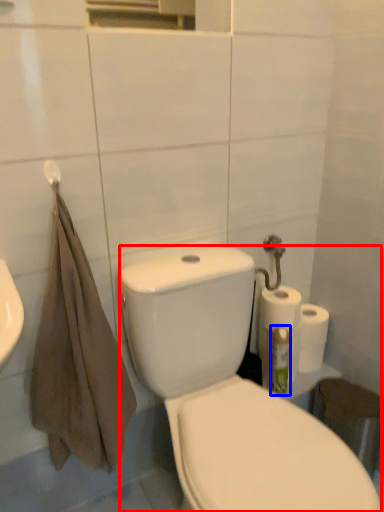
Question: Which object appears farthest to the camera in this image, porcelain (highlighted by a red box) or cleaning product (highlighted by a blue box)?

Choices:
 (A) porcelain
 (B) cleaning product

Answer: (B)